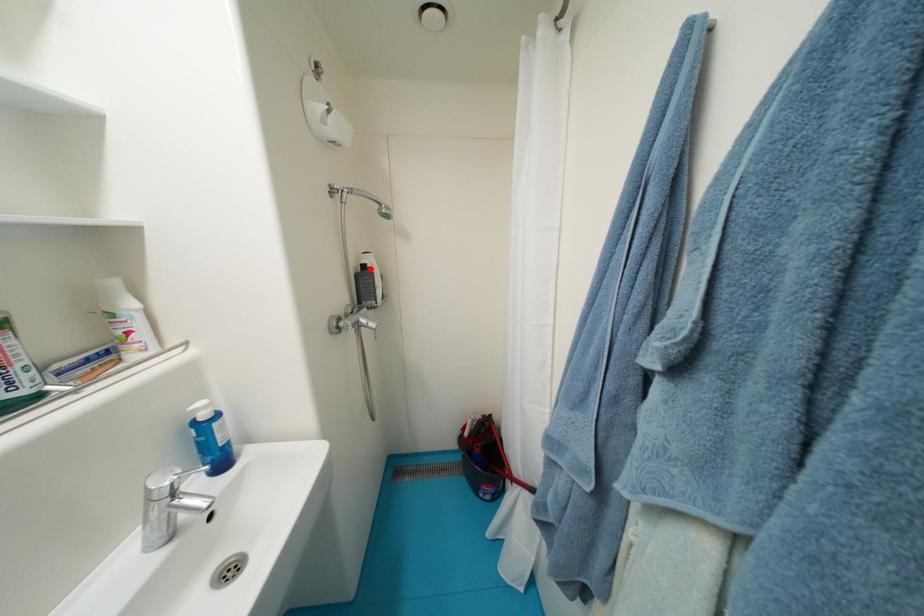
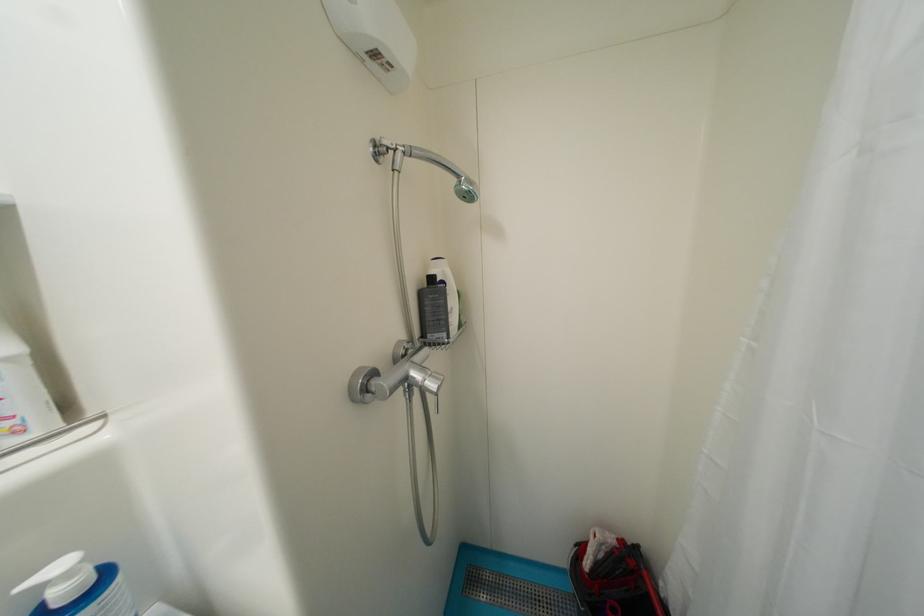
Where in the second image is the point corresponding to the highlighted location from the first image?

(439, 281)